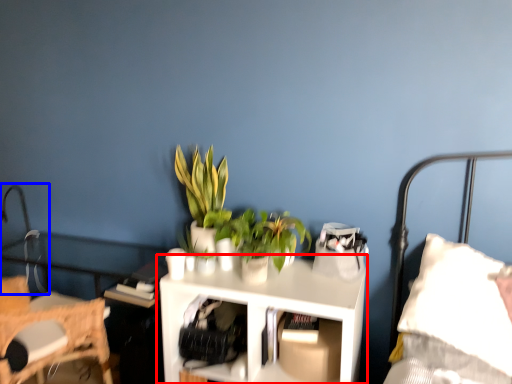
Question: Which of the following is the farthest to the observer, table (highlighted by a red box) or table lamp (highlighted by a blue box)?

Choices:
 (A) table
 (B) table lamp

Answer: (B)